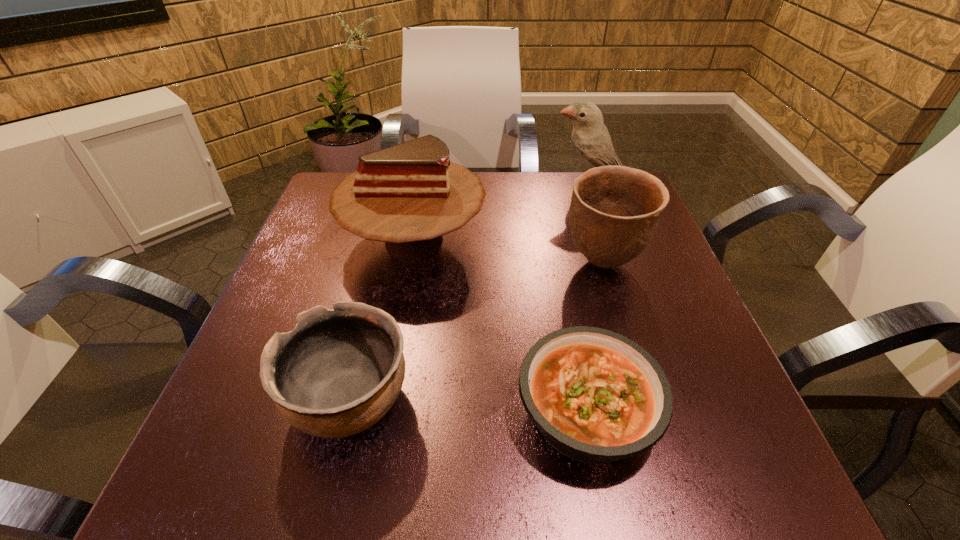
Identify the location of vacant point located between the taller pottery and the cake. (509, 252).

Image resolution: width=960 pixels, height=540 pixels. I want to click on unoccupied position between the nearer pottery and the right pottery, so click(x=477, y=332).

Where is `vacant space that is in between the cake and the farthest object`? The height and width of the screenshot is (540, 960). vacant space that is in between the cake and the farthest object is located at coordinates (501, 213).

At what (x,y) coordinates should I click in order to perform the action: click on free space that is in between the stew and the cake. Please return your answer as a coordinate pair (x, y). The height and width of the screenshot is (540, 960). Looking at the image, I should click on (500, 326).

Locate an element on the screen. The width and height of the screenshot is (960, 540). free space between the second shortest object and the shortest object is located at coordinates (468, 406).

Identify the location of free spot between the shorter pottery and the farther pottery. (477, 332).

Where is `vacant area that lies between the cake and the shortest object`? vacant area that lies between the cake and the shortest object is located at coordinates (500, 326).

Where is `vacant space in between the farthest object and the cake`? The image size is (960, 540). vacant space in between the farthest object and the cake is located at coordinates (501, 213).

Where is `object that is the fourth nearest to the farthest object`? Image resolution: width=960 pixels, height=540 pixels. object that is the fourth nearest to the farthest object is located at coordinates (339, 371).

Point out which object is positioned as the second nearest to the left pottery. Please provide its 2D coordinates. Your answer should be formatted as a tuple, i.e. [(x, y)], where the tuple contains the x and y coordinates of a point satisfying the conditions above.

[(596, 396)]